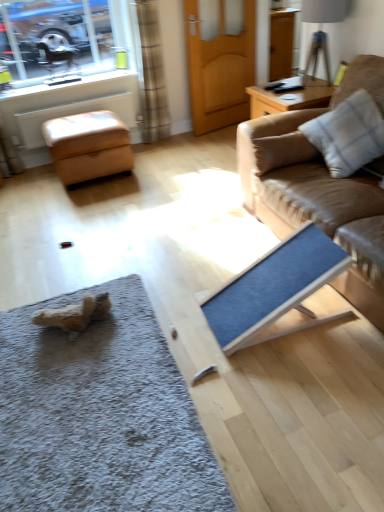
At what (x,y) coordinates should I click in order to perform the action: click on free space in front of leather ottoman at left. Please return your answer as a coordinate pair (x, y). Looking at the image, I should click on (87, 203).